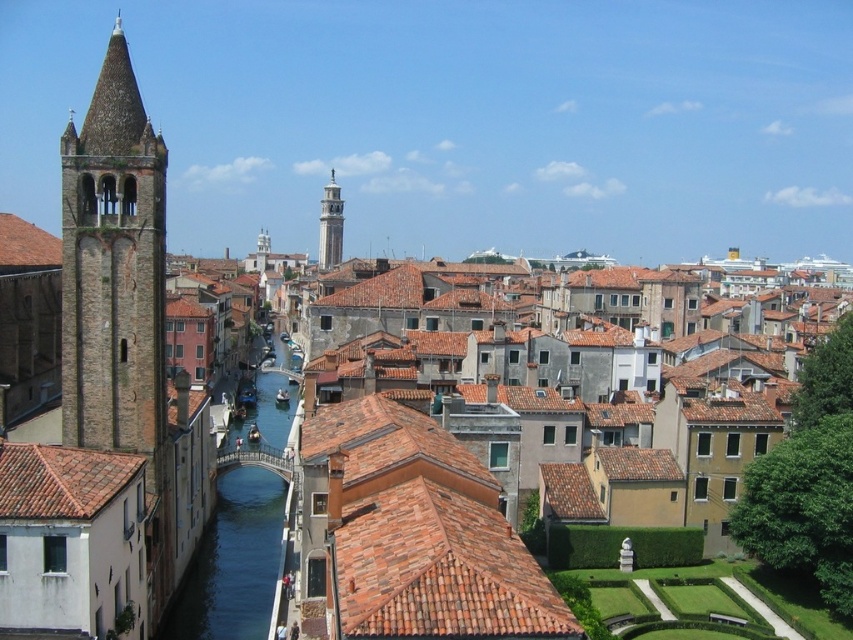
You are standing at the edge of the canal in Venice and want to take a photo of the brown stone tower at left. If your camera can focus on objects up to 200 feet away, will you need to adjust your position to capture the tower clearly?

The brown stone tower at left is 230.33 feet away from the viewer. Since the camera can only focus up to 200 feet, you need to move closer to ensure the tower is within the camera range.

In the scene shown: You are standing at the center of the pedestrian bridge in the canal scene. You want to take a photo of the brown stone tower at left. In which direction should you point your camera to capture the tower in the shot?

The brown stone tower at left is located at point coordinates of 0.425 on the x axis and 0.135 on the y axis. Since you are at the center of the bridge, you should point your camera to the left side to capture the tower in the shot.